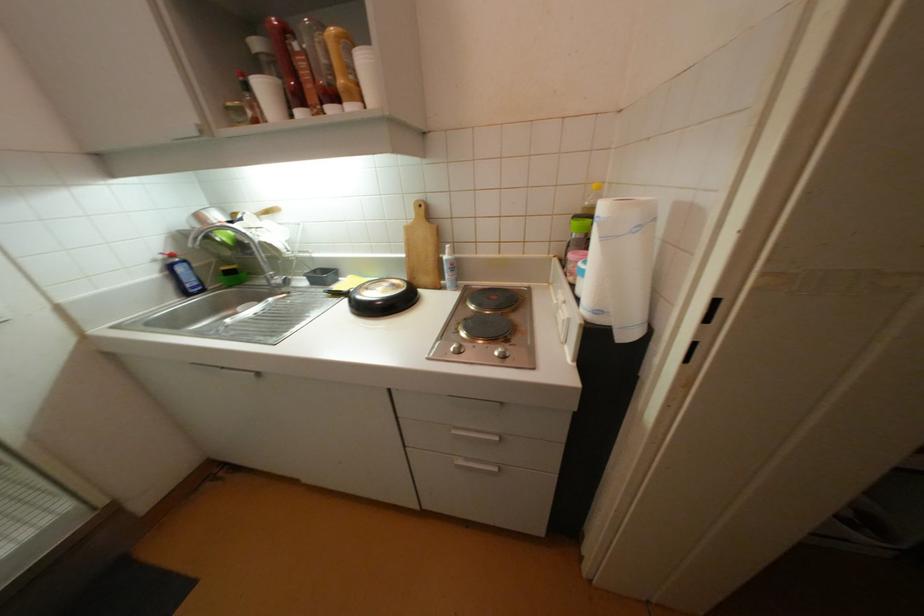
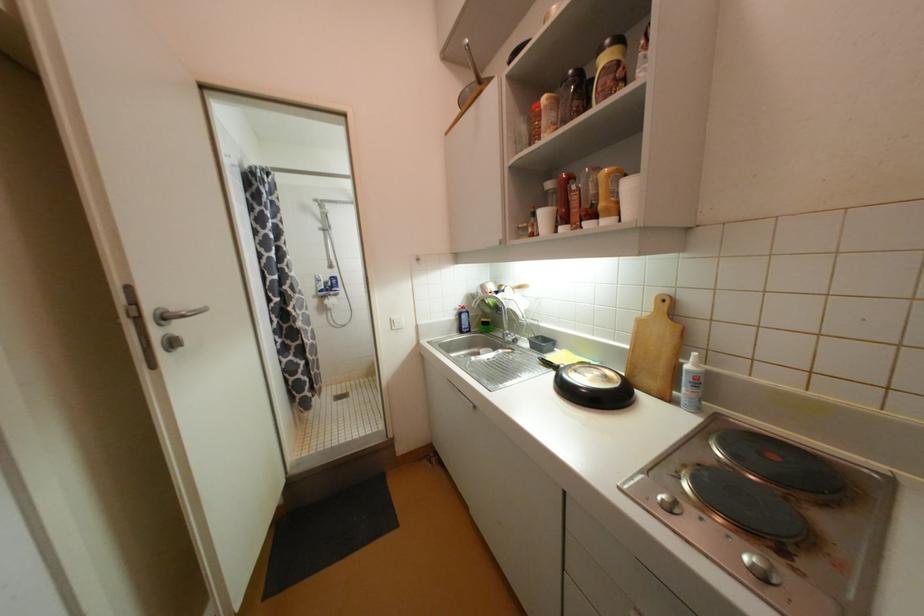
In the second image, find the point that corresponds to [271,90] in the first image.

(550, 216)